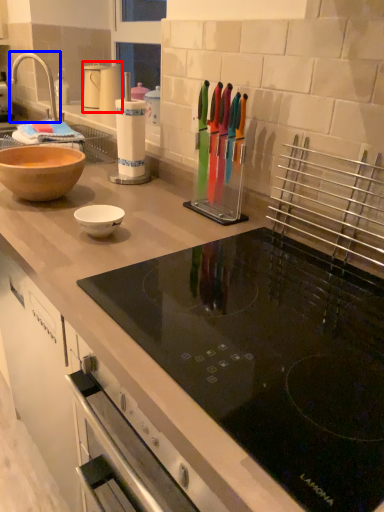
Question: Which object is closer to the camera taking this photo, kitchen appliance (highlighted by a red box) or tap (highlighted by a blue box)?

Choices:
 (A) kitchen appliance
 (B) tap

Answer: (B)